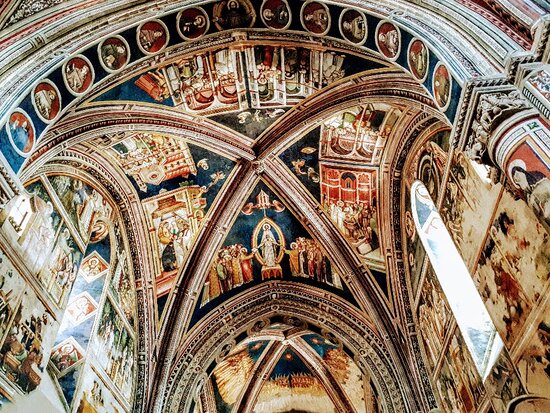
I want to click on church ceiling, so click(x=255, y=171).